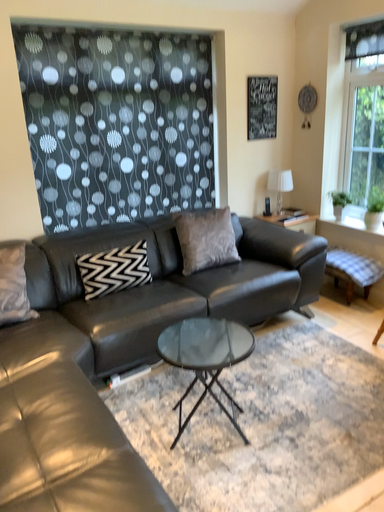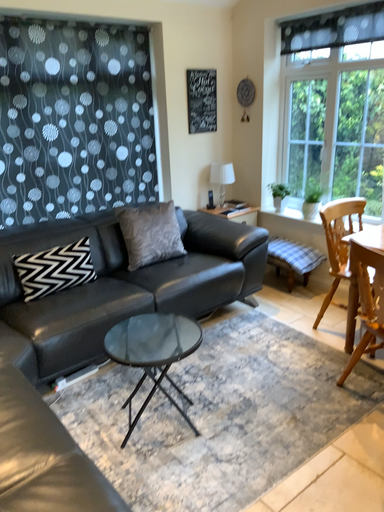
Question: Which way did the camera rotate in the video?

Choices:
 (A) rotated left
 (B) rotated right

Answer: (B)